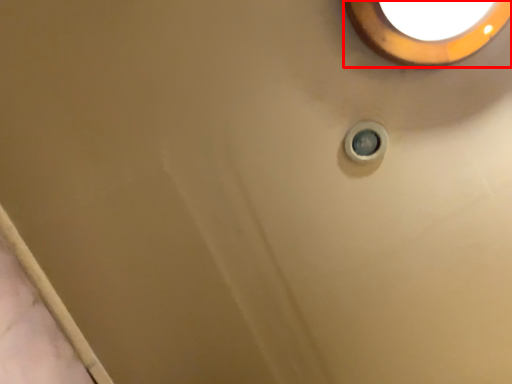
Question: From the image's perspective, where is lighting (annotated by the red box) located in relation to knob in the image?

Choices:
 (A) above
 (B) below

Answer: (A)